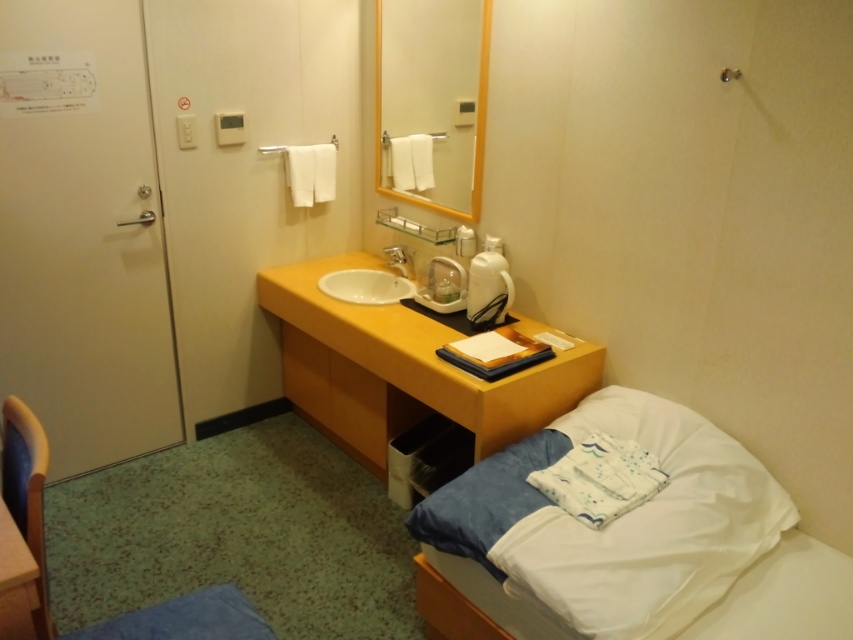
Question: Which point is closer to the camera?

Choices:
 (A) white soft bed at lower right
 (B) yellow matte vanity at center

Answer: (A)

Question: Is yellow matte drawer at center to the right of wooden drawer at lower right from the viewer's perspective?

Choices:
 (A) no
 (B) yes

Answer: (A)

Question: Can you confirm if yellow-framed mirror at upper center is positioned above yellow matte drawer at center?

Choices:
 (A) no
 (B) yes

Answer: (B)

Question: Which of the following is the farthest from the observer?

Choices:
 (A) silver metallic faucet at center
 (B) yellow matte drawer at center
 (C) yellow-framed mirror at upper center

Answer: (A)

Question: Can you confirm if yellow matte vanity at center is positioned to the left of yellow-framed mirror at upper center?

Choices:
 (A) yes
 (B) no

Answer: (A)

Question: Which of the following is the closest to the observer?

Choices:
 (A) wooden drawer at lower right
 (B) yellow matte vanity at center
 (C) white soft bed at lower right

Answer: (C)